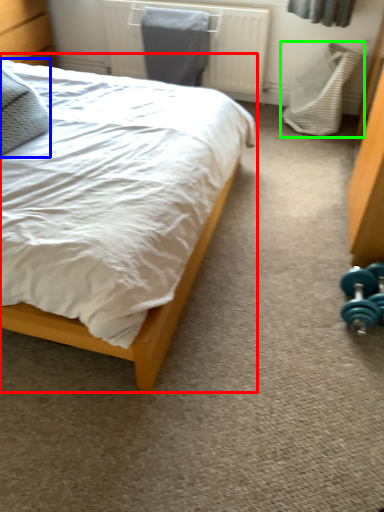
Question: Based on their relative distances, which object is farther from bed (highlighted by a red box)? Choose from pillow (highlighted by a blue box) and swivel chair (highlighted by a green box).

Choices:
 (A) pillow
 (B) swivel chair

Answer: (B)